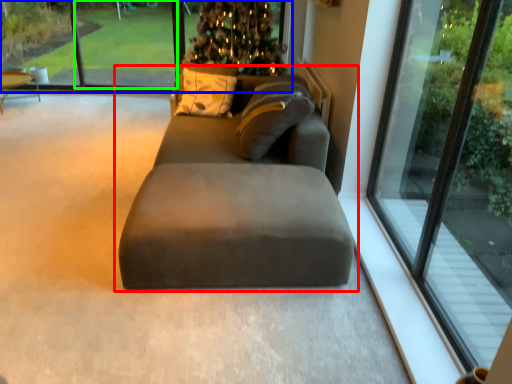
Question: Which is farther away from studio couch (highlighted by a red box)? window screen (highlighted by a blue box) or window screen (highlighted by a green box)?

Choices:
 (A) window screen
 (B) window screen

Answer: (A)